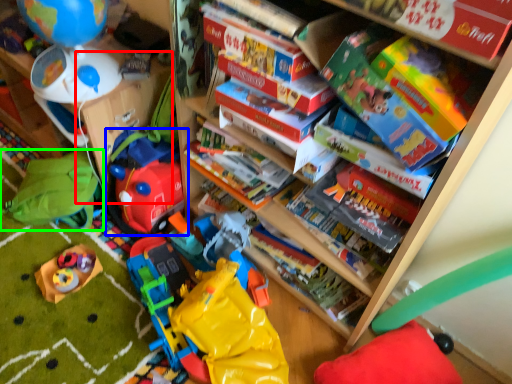
Question: Which object is positioned closest to shelf (highlighted by a red box)? Select from toy (highlighted by a blue box) and toy (highlighted by a green box).

Choices:
 (A) toy
 (B) toy

Answer: (A)